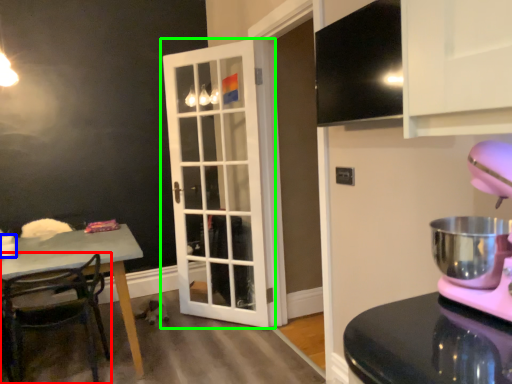
Question: Based on their relative distances, which object is farther from chair (highlighted by a red box)? Choose from coffee cup (highlighted by a blue box) and door (highlighted by a green box).

Choices:
 (A) coffee cup
 (B) door

Answer: (B)